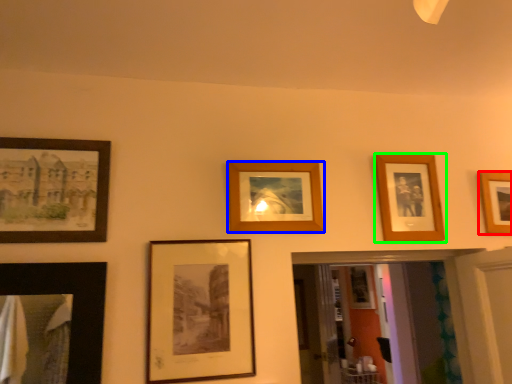
Question: Based on their relative distances, which object is nearer to picture frame (highlighted by a red box)? Choose from picture frame (highlighted by a blue box) and picture frame (highlighted by a green box).

Choices:
 (A) picture frame
 (B) picture frame

Answer: (B)